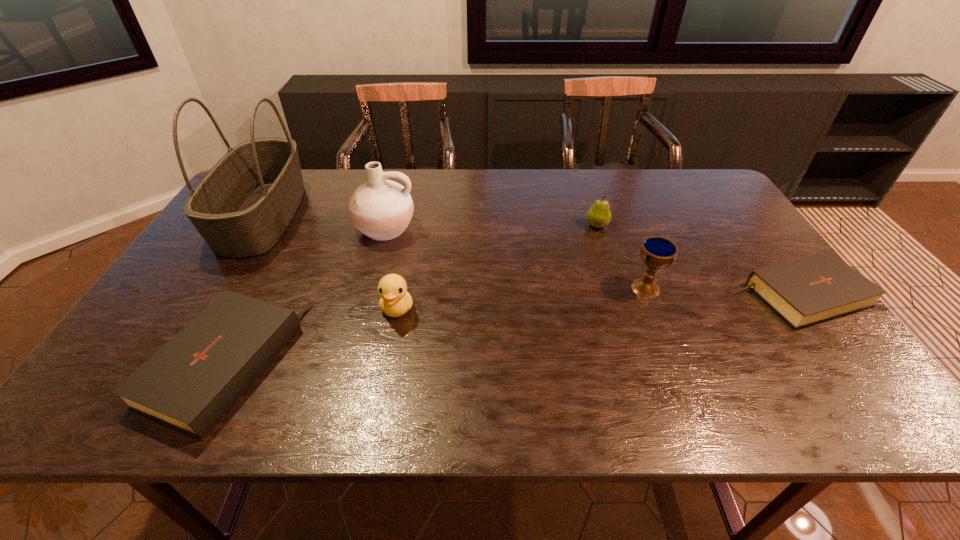
You are a GUI agent. You are given a task and a screenshot of the screen. Output one action in this format:
    pyautogui.click(x=<x>, y=<y>)
    Task: Click on the free location that satisfies the following two spatial constraints: 1. to pour from the handle of the sixth shortest object; 2. on the left side of the fifth shortest object
    The image size is (960, 540).
    Given the screenshot: What is the action you would take?
    pyautogui.click(x=369, y=288)